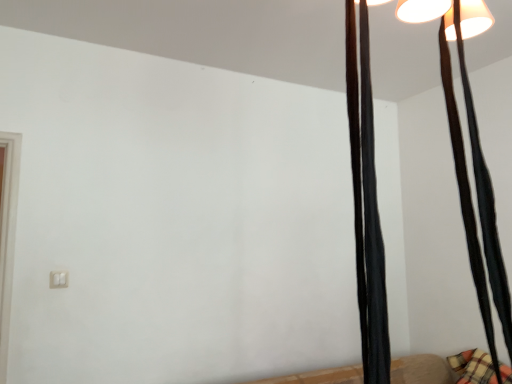
Question: Are black fabric curtain at right, which is the second curtain in back-to-front order, and black fabric curtain at upper right, which is counted as the 2th curtain, starting from the front, far apart?

Choices:
 (A) no
 (B) yes

Answer: (A)

Question: Is black fabric curtain at upper right, the 2th curtain viewed from the left, at the back of black fabric curtain at right, which is the second curtain in back-to-front order?

Choices:
 (A) yes
 (B) no

Answer: (B)

Question: Is black fabric curtain at right, which is counted as the second curtain, starting from the right, wider than black fabric curtain at upper right, the 2th curtain viewed from the left?

Choices:
 (A) no
 (B) yes

Answer: (A)

Question: Does black fabric curtain at right, which is the second curtain in back-to-front order, appear on the right side of black fabric curtain at upper right, which ranks as the 1th curtain in right-to-left order?

Choices:
 (A) no
 (B) yes

Answer: (A)

Question: Is black fabric curtain at right, which is counted as the second curtain, starting from the right, next to black fabric curtain at upper right, the 1th curtain in the back-to-front sequence, and touching it?

Choices:
 (A) no
 (B) yes

Answer: (A)

Question: Is black fabric curtain at right, which is counted as the second curtain, starting from the right, closer to camera compared to black fabric curtain at upper right, which is counted as the 2th curtain, starting from the front?

Choices:
 (A) yes
 (B) no

Answer: (A)

Question: Does black fabric curtain at upper right, the 1th curtain in the back-to-front sequence, appear on the left side of black fabric curtain at right, which is counted as the second curtain, starting from the right?

Choices:
 (A) no
 (B) yes

Answer: (A)

Question: Is black fabric curtain at upper right, which is counted as the 2th curtain, starting from the front, positioned with its back to black fabric curtain at right, which is the 1th curtain from front to back?

Choices:
 (A) no
 (B) yes

Answer: (A)

Question: From a real-world perspective, is black fabric curtain at upper right, the 2th curtain viewed from the left, positioned over black fabric curtain at right, which is the 1th curtain from front to back, based on gravity?

Choices:
 (A) no
 (B) yes

Answer: (B)

Question: Is black fabric curtain at upper right, which is counted as the 2th curtain, starting from the front, shorter than black fabric curtain at right, which is the 1th curtain from front to back?

Choices:
 (A) yes
 (B) no

Answer: (B)

Question: Is black fabric curtain at upper right, the 2th curtain viewed from the left, taller than black fabric curtain at right, which is the 1th curtain from front to back?

Choices:
 (A) yes
 (B) no

Answer: (A)

Question: From the image's perspective, does black fabric curtain at upper right, the 1th curtain in the back-to-front sequence, appear higher than black fabric curtain at right, which is the second curtain in back-to-front order?

Choices:
 (A) no
 (B) yes

Answer: (B)

Question: From the image's perspective, relative to black fabric curtain at right, which is the second curtain in back-to-front order, is black fabric curtain at upper right, the 2th curtain viewed from the left, above or below?

Choices:
 (A) above
 (B) below

Answer: (A)